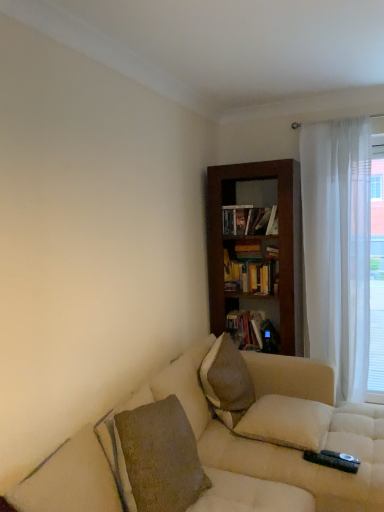
What do you see at coordinates (338, 248) in the screenshot?
I see `white sheer curtain at right` at bounding box center [338, 248].

How much space does brown textured pillow at center, placed as the 2th pillow when sorted from bottom to top, occupy horizontally?

12.51 inches.

I want to click on white soft pillow at lower right, which ranks as the 2th pillow in top-to-bottom order, so click(x=286, y=422).

Identify the location of matte black bookshelf at center, placed as the 1th book when sorted from bottom to top. (246, 328).

This screenshot has width=384, height=512. I want to click on wooden bookshelf at center, which is counted as the 2th book, starting from the bottom, so click(x=251, y=274).

Describe the element at coordinates (372, 260) in the screenshot. I see `white sheer curtain at right` at that location.

The height and width of the screenshot is (512, 384). I want to click on white sheer curtain at right, so click(x=338, y=248).

Is point (257, 274) farther from viewer compared to point (335, 343)?

That is False.

Which of these two, wooden bookshelf at center, which is the 2th book in top-to-bottom order, or white sheer curtain at right, is bigger?

With larger size is white sheer curtain at right.

Considering the relative positions of wooden bookshelf at center, which is counted as the 2th book, starting from the bottom, and white sheer curtain at right in the image provided, is wooden bookshelf at center, which is counted as the 2th book, starting from the bottom, behind white sheer curtain at right?

Yes, it is behind white sheer curtain at right.

How different are the orientations of wooden bookshelf at center, which is counted as the 2th book, starting from the bottom, and white sheer curtain at right in degrees?

The facing directions of wooden bookshelf at center, which is counted as the 2th book, starting from the bottom, and white sheer curtain at right are 4.51 degrees apart.

Is white sheer curtain at right outside of wooden bookshelf at center, which is counted as the 2th book, starting from the bottom?

Indeed, white sheer curtain at right is completely outside wooden bookshelf at center, which is counted as the 2th book, starting from the bottom.

Between white sheer curtain at right and wooden bookshelf at center, which is the 2th book in top-to-bottom order, which one has more height?

Standing taller between the two is white sheer curtain at right.

Which object is further away from the camera taking this photo, white sheer curtain at right or wooden bookshelf at center, which is counted as the 2th book, starting from the bottom?

wooden bookshelf at center, which is counted as the 2th book, starting from the bottom, is further from the camera.

Would you consider matte black bookshelf at center, the third book positioned from the top, to be distant from white soft pillow at lower right, which is the 1th pillow in bottom-to-top order?

No, there isn't a large distance between matte black bookshelf at center, the third book positioned from the top, and white soft pillow at lower right, which is the 1th pillow in bottom-to-top order.

Between matte black bookshelf at center, placed as the 1th book when sorted from bottom to top, and white soft pillow at lower right, which is the 1th pillow in bottom-to-top order, which one appears on the left side from the viewer's perspective?

matte black bookshelf at center, placed as the 1th book when sorted from bottom to top, is more to the left.

Is matte black bookshelf at center, the third book positioned from the top, oriented away from white soft pillow at lower right, which ranks as the 2th pillow in top-to-bottom order?

No.

Is matte black bookshelf at center, placed as the 1th book when sorted from bottom to top, taller or shorter than white soft pillow at lower right, which is the 1th pillow in bottom-to-top order?

Clearly, matte black bookshelf at center, placed as the 1th book when sorted from bottom to top, is taller compared to white soft pillow at lower right, which is the 1th pillow in bottom-to-top order.

Which of these two, wooden bookshelf at center, which is counted as the 2th book, starting from the bottom, or brown textured pillow at center, positioned as the 1th pillow in top-to-bottom order, is smaller?

wooden bookshelf at center, which is counted as the 2th book, starting from the bottom, is smaller.

From a real-world perspective, is wooden bookshelf at center, which is counted as the 2th book, starting from the bottom, positioned over brown textured pillow at center, positioned as the 1th pillow in top-to-bottom order, based on gravity?

Indeed, from a real-world perspective, wooden bookshelf at center, which is counted as the 2th book, starting from the bottom, stands above brown textured pillow at center, positioned as the 1th pillow in top-to-bottom order.

From the image's perspective, which is above, wooden bookshelf at center, which is counted as the 2th book, starting from the bottom, or brown textured pillow at center, placed as the 2th pillow when sorted from bottom to top?

wooden bookshelf at center, which is counted as the 2th book, starting from the bottom, is shown above in the image.

What's the angular difference between white soft pillow at lower right, which ranks as the 2th pillow in top-to-bottom order, and brown textured pillow at center, positioned as the 1th pillow in top-to-bottom order,'s facing directions?

The angle between the facing direction of white soft pillow at lower right, which ranks as the 2th pillow in top-to-bottom order, and the facing direction of brown textured pillow at center, positioned as the 1th pillow in top-to-bottom order, is 10.1 degrees.

Looking at the image, does white soft pillow at lower right, which is the 1th pillow in bottom-to-top order, seem bigger or smaller compared to brown textured pillow at center, positioned as the 1th pillow in top-to-bottom order?

Clearly, white soft pillow at lower right, which is the 1th pillow in bottom-to-top order, is smaller in size than brown textured pillow at center, positioned as the 1th pillow in top-to-bottom order.

Between white soft pillow at lower right, which is the 1th pillow in bottom-to-top order, and brown textured pillow at center, placed as the 2th pillow when sorted from bottom to top, which one has smaller width?

Thinner between the two is brown textured pillow at center, placed as the 2th pillow when sorted from bottom to top.

From the picture: Who is taller, white soft pillow at lower right, which is the 1th pillow in bottom-to-top order, or brown textured pillow at center, positioned as the 1th pillow in top-to-bottom order?

brown textured pillow at center, positioned as the 1th pillow in top-to-bottom order, is taller.

Are dark wood bookcase at center and hardcover book at upper center, which appears as the 3th book when ordered from the bottom, making contact?

No, dark wood bookcase at center is not making contact with hardcover book at upper center, which appears as the 3th book when ordered from the bottom.

From the image's perspective, which one is positioned higher, dark wood bookcase at center or hardcover book at upper center, which appears as the 3th book when ordered from the bottom?

hardcover book at upper center, which appears as the 3th book when ordered from the bottom.

Is dark wood bookcase at center facing away from hardcover book at upper center, which appears as the 3th book when ordered from the bottom?

Yes.

Which object is thinner, dark wood bookcase at center or hardcover book at upper center, which is the first book in top-to-bottom order?

hardcover book at upper center, which is the first book in top-to-bottom order, is thinner.

Is white sheer curtain at right taller than brown textured pillow at center, placed as the 2th pillow when sorted from bottom to top?

Yes, white sheer curtain at right is taller than brown textured pillow at center, placed as the 2th pillow when sorted from bottom to top.

Does point (348, 248) come behind point (217, 347)?

Yes, point (348, 248) is behind point (217, 347).

Are white sheer curtain at right and brown textured pillow at center, placed as the 2th pillow when sorted from bottom to top, far apart?

white sheer curtain at right is positioned a significant distance from brown textured pillow at center, placed as the 2th pillow when sorted from bottom to top.

Looking at their sizes, would you say white sheer curtain at right is wider or thinner than brown textured pillow at center, positioned as the 1th pillow in top-to-bottom order?

white sheer curtain at right is wider than brown textured pillow at center, positioned as the 1th pillow in top-to-bottom order.

The image size is (384, 512). I want to click on the 1st book counting from the left of the white sheer curtain at right, so click(251, 274).

From the image's perspective, count 1st books downward from the white sheer curtain at right and point to it. Please provide its 2D coordinates.

[(251, 274)]

Considering their positions, is hardcover book at upper center, which is the first book in top-to-bottom order, positioned further to white soft pillow at lower right, which ranks as the 2th pillow in top-to-bottom order, than white sheer curtain at right?

hardcover book at upper center, which is the first book in top-to-bottom order, is further to white soft pillow at lower right, which ranks as the 2th pillow in top-to-bottom order.

From the picture: Estimate the real-world distances between objects in this image. Which object is closer to wooden bookshelf at center, which is counted as the 2th book, starting from the bottom, beige fabric couch at lower center or white sheer curtain at right?

white sheer curtain at right is positioned closer to the anchor wooden bookshelf at center, which is counted as the 2th book, starting from the bottom.

Which object lies nearer to the anchor point hardcover book at upper center, which is the first book in top-to-bottom order, white sheer curtain at right or white sheer curtain at right?

The object closer to hardcover book at upper center, which is the first book in top-to-bottom order, is white sheer curtain at right.

Looking at the image, which one is located further to beige fabric couch at lower center, dark wood bookcase at center or white sheer curtain at right?

white sheer curtain at right is further to beige fabric couch at lower center.

Considering their positions, is brown textured pillow at center, positioned as the 1th pillow in top-to-bottom order, positioned closer to matte black bookshelf at center, placed as the 1th book when sorted from bottom to top, than white soft pillow at lower right, which ranks as the 2th pillow in top-to-bottom order?

brown textured pillow at center, positioned as the 1th pillow in top-to-bottom order, is closer to matte black bookshelf at center, placed as the 1th book when sorted from bottom to top.

Looking at the image, which one is located closer to wooden bookshelf at center, which is the 2th book in top-to-bottom order, white sheer curtain at right or dark wood bookcase at center?

Based on the image, dark wood bookcase at center appears to be nearer to wooden bookshelf at center, which is the 2th book in top-to-bottom order.

Which object lies nearer to the anchor point dark wood bookcase at center, beige fabric couch at lower center or hardcover book at upper center, which appears as the 3th book when ordered from the bottom?

hardcover book at upper center, which appears as the 3th book when ordered from the bottom, is closer to dark wood bookcase at center.

Looking at the image, which one is located further to beige fabric couch at lower center, white soft pillow at lower right, which is the 1th pillow in bottom-to-top order, or dark wood bookcase at center?

The object further to beige fabric couch at lower center is dark wood bookcase at center.

Locate an element on the screen. The height and width of the screenshot is (512, 384). book between matte black bookshelf at center, placed as the 1th book when sorted from bottom to top, and white sheer curtain at right is located at coordinates (251, 274).

This screenshot has width=384, height=512. Identify the location of pillow located between white soft pillow at lower right, which ranks as the 2th pillow in top-to-bottom order, and white sheer curtain at right in the depth direction. (227, 381).

In order to click on book between dark wood bookcase at center and white sheer curtain at right from left to right in this screenshot , I will do [251, 274].

The image size is (384, 512). What are the coordinates of `curtain situated between hardcover book at upper center, which appears as the 3th book when ordered from the bottom, and white sheer curtain at right from left to right` in the screenshot? It's located at (338, 248).